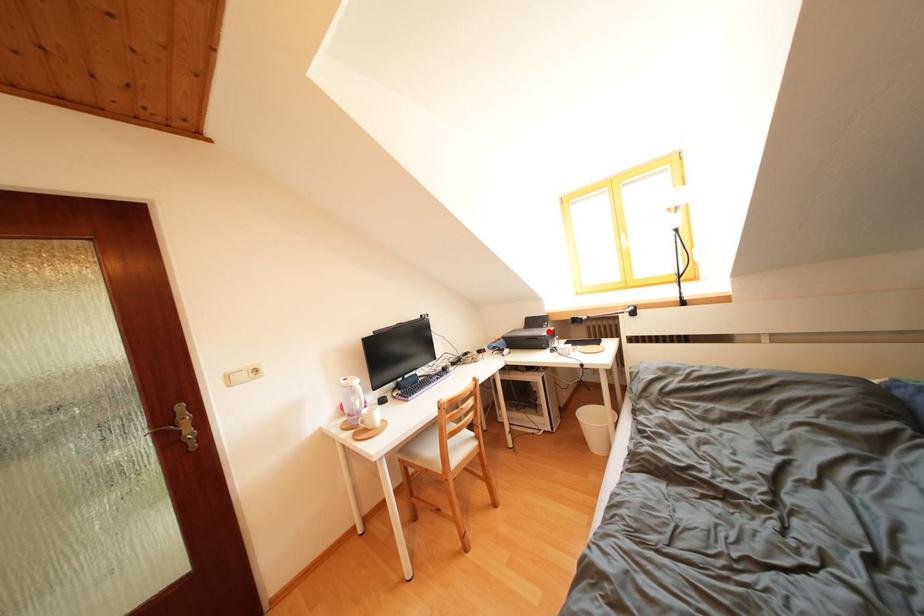
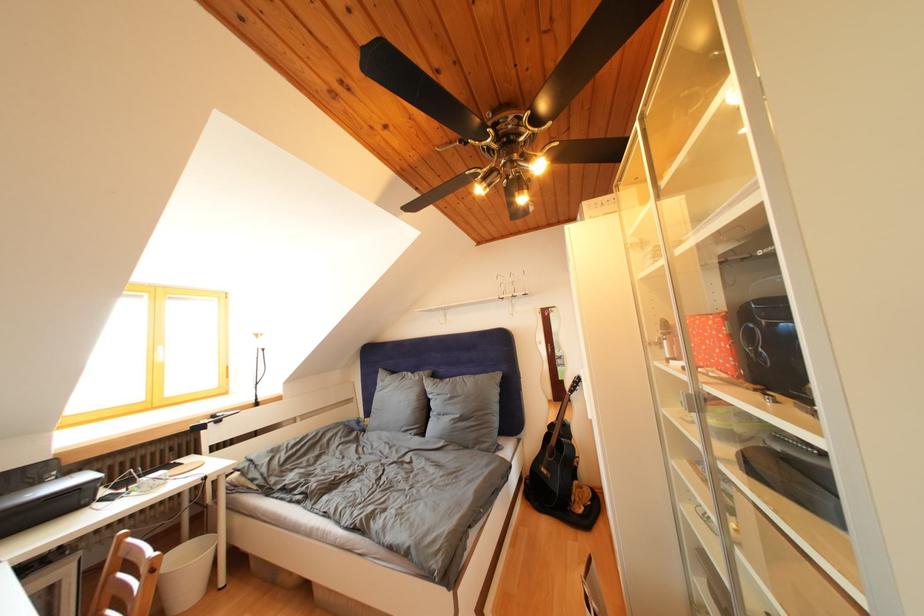
In the second image, find the point that corresponds to the highlighted location in the first image.

(44, 488)